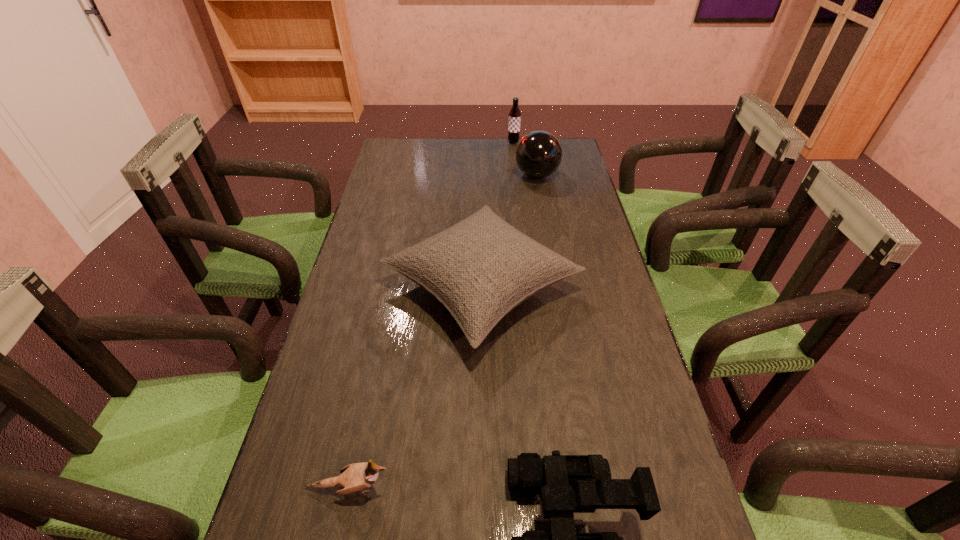
The width and height of the screenshot is (960, 540). What are the coordinates of `root beer that is at the far edge` in the screenshot? It's located at (514, 121).

The width and height of the screenshot is (960, 540). Find the location of `bowling ball positioned at the far edge`. bowling ball positioned at the far edge is located at coordinates (538, 154).

Image resolution: width=960 pixels, height=540 pixels. I want to click on cushion present at the left edge, so click(481, 268).

What are the coordinates of `bird that is at the left edge` in the screenshot? It's located at (358, 477).

I want to click on bowling ball positioned at the right edge, so click(x=538, y=154).

You are a GUI agent. You are given a task and a screenshot of the screen. Output one action in this format:
    pyautogui.click(x=<x>, y=<y>)
    Task: Click on the cushion at the right edge
    This screenshot has width=960, height=540.
    Given the screenshot: What is the action you would take?
    pyautogui.click(x=481, y=268)

The image size is (960, 540). In order to click on object that is positioned at the far right corner in this screenshot , I will do 538,154.

Find the location of a particular element. free region at the far edge of the desktop is located at coordinates tap(445, 167).

In the image, there is a desktop. Where is `vacant space at the left edge`? This screenshot has height=540, width=960. vacant space at the left edge is located at coordinates (325, 335).

Locate an element on the screen. vacant space at the right edge is located at coordinates 661,430.